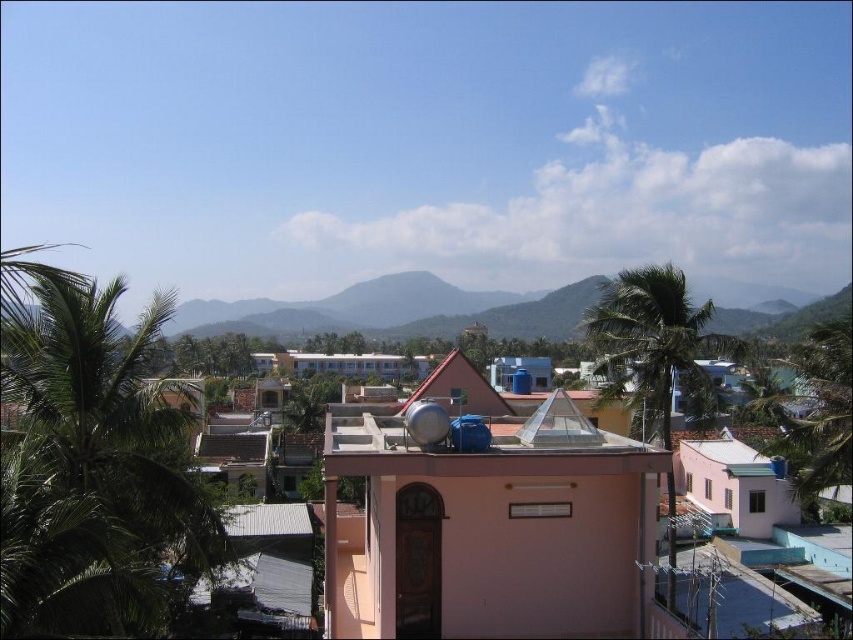
Between green leafy palm tree at left and green leafy palm tree at center, which one is positioned lower?

green leafy palm tree at center is lower down.

Can you confirm if green leafy palm tree at left is shorter than green leafy palm tree at center?

Correct, green leafy palm tree at left is not as tall as green leafy palm tree at center.

Which is behind, point (111, 576) or point (706, 348)?

Point (706, 348)

You are a GUI agent. You are given a task and a screenshot of the screen. Output one action in this format:
    pyautogui.click(x=<x>, y=<y>)
    Task: Click on the green leafy palm tree at left
    The width and height of the screenshot is (853, 640).
    Given the screenshot: What is the action you would take?
    pyautogui.click(x=88, y=464)